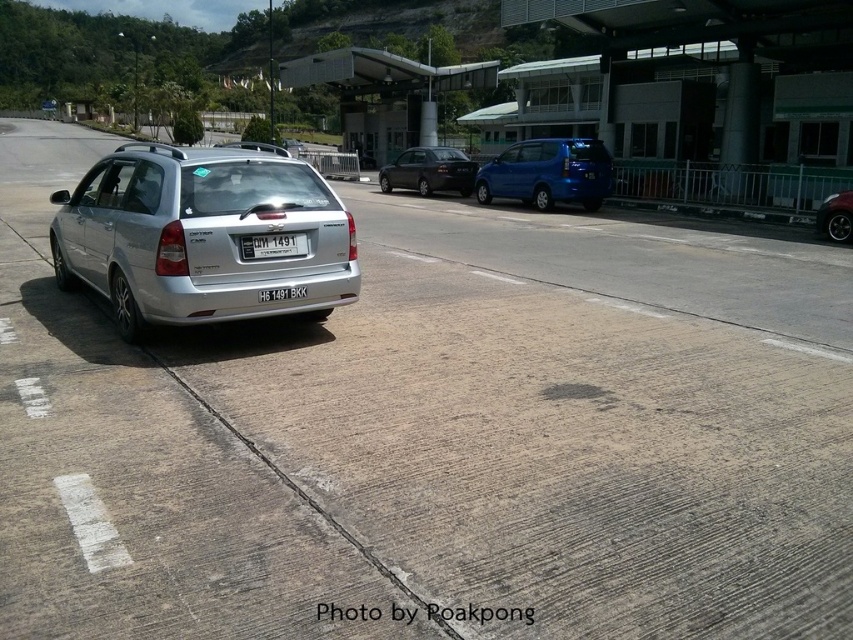
Question: Which point appears closest to the camera in this image?

Choices:
 (A) (550, 161)
 (B) (387, 170)
 (C) (821, 230)

Answer: (C)

Question: From the image, what is the correct spatial relationship of silver metallic hatchback at left in relation to glossy blue minivan at center?

Choices:
 (A) right
 (B) left

Answer: (B)

Question: Is glossy blue minivan at center above gray concrete curb at lower center?

Choices:
 (A) yes
 (B) no

Answer: (A)

Question: Estimate the real-world distances between objects in this image. Which object is closer to the shiny black sedan at center?

Choices:
 (A) gray concrete curb at lower center
 (B) shiny black car at right
 (C) glossy blue minivan at center
 (D) white plastic license plate at center

Answer: (C)

Question: Among these objects, which one is farthest from the camera?

Choices:
 (A) silver metallic hatchback at left
 (B) glossy blue minivan at center
 (C) silver metallic hatchback at center
 (D) gray concrete curb at lower center

Answer: (B)

Question: Is glossy blue minivan at center bigger than white plastic license plate at center?

Choices:
 (A) yes
 (B) no

Answer: (A)